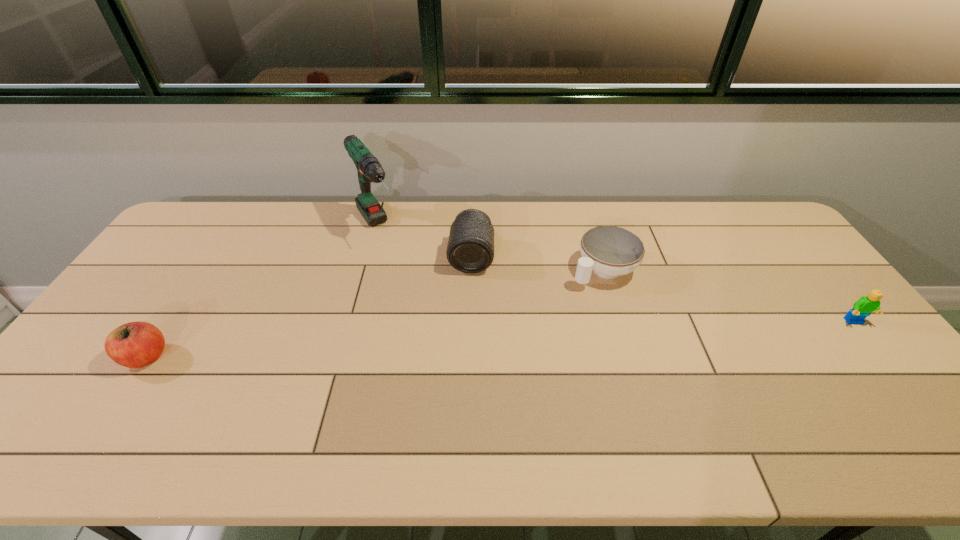
Where is `vacant space on the desktop that is between the nearest object and the rightmost object and is positioned on the side with the handle of the second object from right to left`? This screenshot has width=960, height=540. vacant space on the desktop that is between the nearest object and the rightmost object and is positioned on the side with the handle of the second object from right to left is located at coordinates (499, 340).

Find the location of a particular element. The width and height of the screenshot is (960, 540). vacant spot on the desktop that is between the leftmost object and the Lego and is positioned on the surface of the third object from left to right is located at coordinates (465, 341).

Locate an element on the screen. free space on the desktop that is between the leftmost object and the second nearest object and is positioned on the handle side of the tallest object is located at coordinates (456, 342).